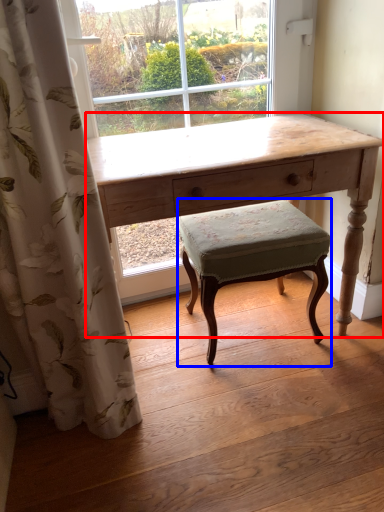
Question: Among these objects, which one is farthest to the camera, desk (highlighted by a red box) or stool (highlighted by a blue box)?

Choices:
 (A) desk
 (B) stool

Answer: (B)